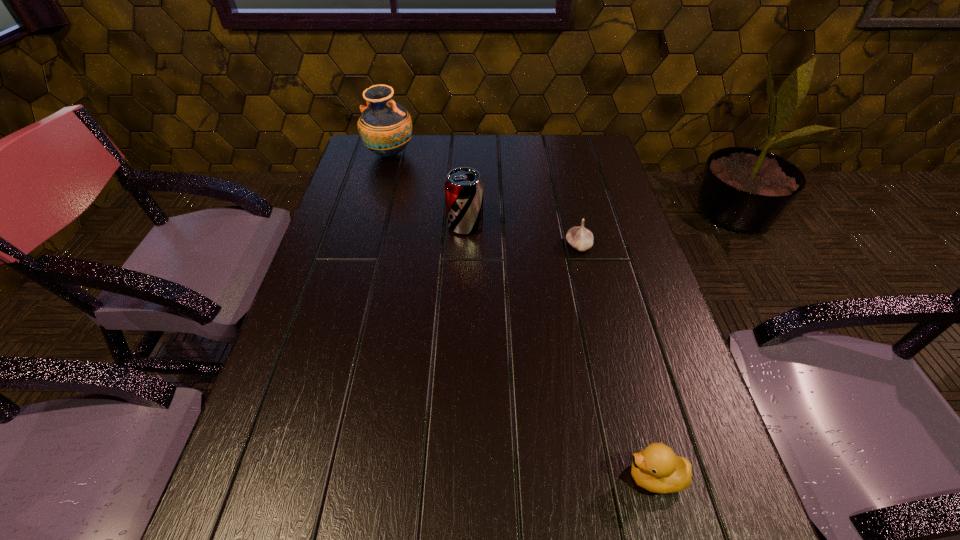
Point out which object is positioned as the second nearest to the soda can. Please provide its 2D coordinates. Your answer should be formatted as a tuple, i.e. [(x, y)], where the tuple contains the x and y coordinates of a point satisfying the conditions above.

[(385, 126)]

Where is `object that is the closest to the second tallest object`? Image resolution: width=960 pixels, height=540 pixels. object that is the closest to the second tallest object is located at coordinates (580, 238).

You are a GUI agent. You are given a task and a screenshot of the screen. Output one action in this format:
    pyautogui.click(x=<x>, y=<y>)
    Task: Click on the vacant space that satisfies the following two spatial constraints: 1. on the front side of the third shortest object; 2. on the right side of the garlic
    This screenshot has height=540, width=960.
    Given the screenshot: What is the action you would take?
    pyautogui.click(x=465, y=246)